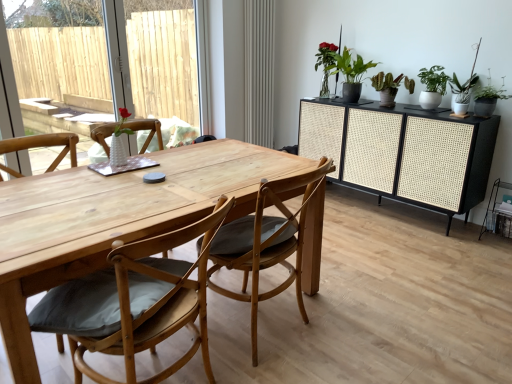
Question: Is green matte plant at upper right, which is the third houseplant from left to right, taller or shorter than natural wood chair at center, which is counted as the 1th chair, starting from the right?

Choices:
 (A) tall
 (B) short

Answer: (B)

Question: In terms of width, does green matte plant at upper right, the first houseplant viewed from the right, look wider or thinner when compared to natural wood chair at center, arranged as the second chair when viewed from the left?

Choices:
 (A) wide
 (B) thin

Answer: (B)

Question: Based on their relative distances, which object is nearer to the white textured vase at left?

Choices:
 (A) black woven cabinet at right
 (B) matte gray radiator at center
 (C) natural wood chair at center, which is counted as the 1th chair, starting from the right
 (D) green matte plant at upper right, which is the third houseplant from left to right
 (E) green glossy vase at upper center

Answer: (B)

Question: Estimate the real-world distances between objects in this image. Which object is farther from the natural wood table at center?

Choices:
 (A) matte gray radiator at center
 (B) green glossy vase at upper center
 (C) green matte plant at upper right, which is the third houseplant from left to right
 (D) wooden chair with cushion at center, which is counted as the 2th chair, starting from the right
 (E) white textured vase at left

Answer: (E)